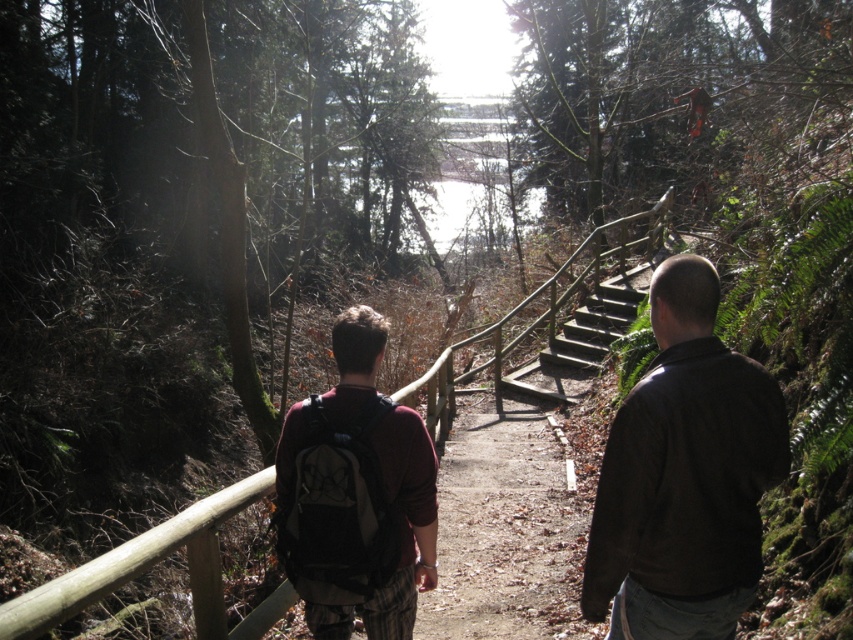
Is dark brown leather jacket at right positioned behind maroon fabric backpack at center?

No.

Which is in front, point (740, 589) or point (415, 600)?

Point (740, 589) is in front.

Identify the location of dark brown leather jacket at right. The width and height of the screenshot is (853, 640). (683, 476).

Who is lower down, maroon fabric backpack at center or wooden at center?

wooden at center is lower down.

Can you confirm if maroon fabric backpack at center is positioned to the left of wooden at center?

Correct, you'll find maroon fabric backpack at center to the left of wooden at center.

Is point (399, 464) less distant than point (10, 605)?

No, it is not.

The image size is (853, 640). Find the location of `maroon fabric backpack at center`. maroon fabric backpack at center is located at coordinates (364, 493).

Can you confirm if dark brown leather jacket at right is positioned to the left of wooden at center?

In fact, dark brown leather jacket at right is to the right of wooden at center.

Is dark brown leather jacket at right smaller than wooden at center?

Indeed, dark brown leather jacket at right has a smaller size compared to wooden at center.

This screenshot has width=853, height=640. Describe the element at coordinates (683, 476) in the screenshot. I see `dark brown leather jacket at right` at that location.

The width and height of the screenshot is (853, 640). Identify the location of dark brown leather jacket at right. (683, 476).